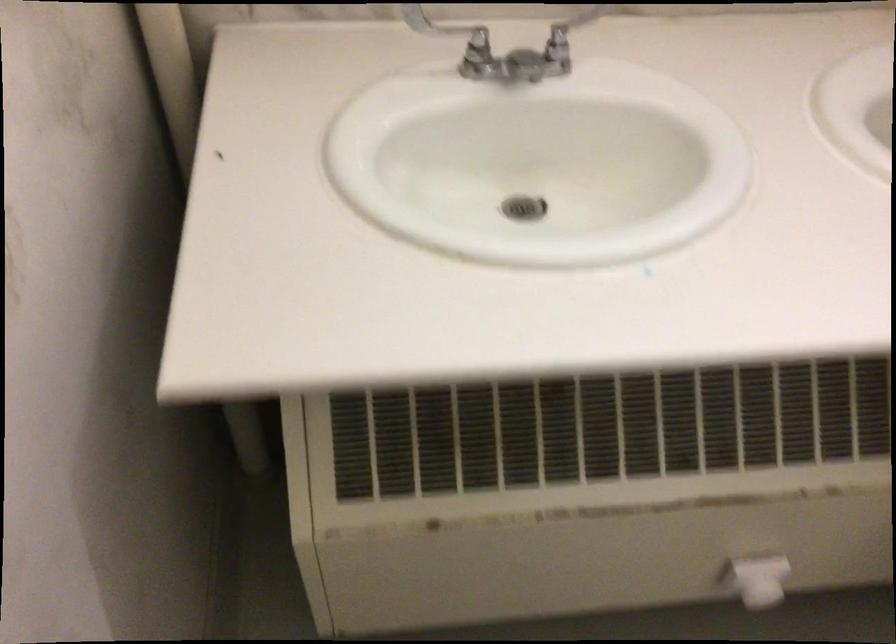
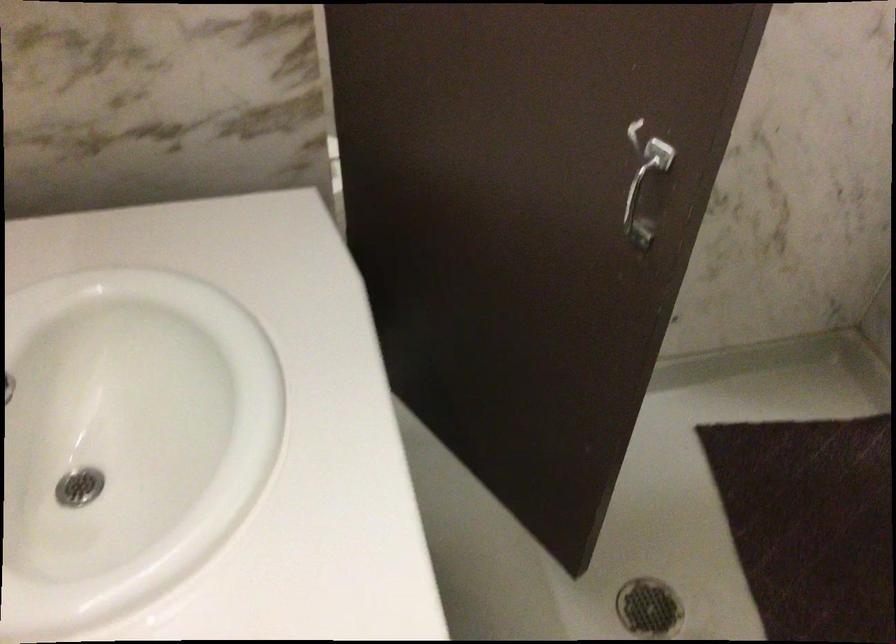
First-person continuous shooting, in which direction is the camera rotating?

The camera rotated toward right-down.